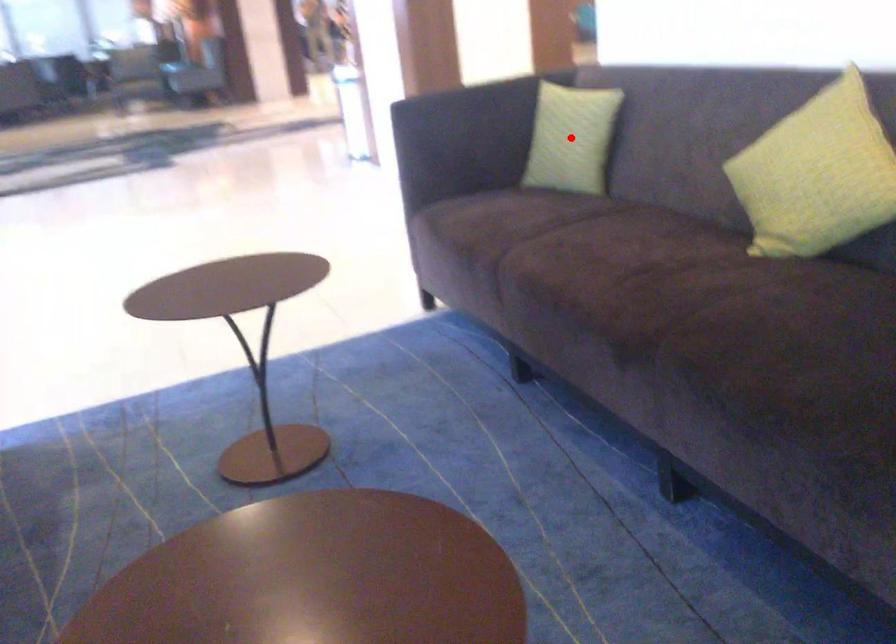
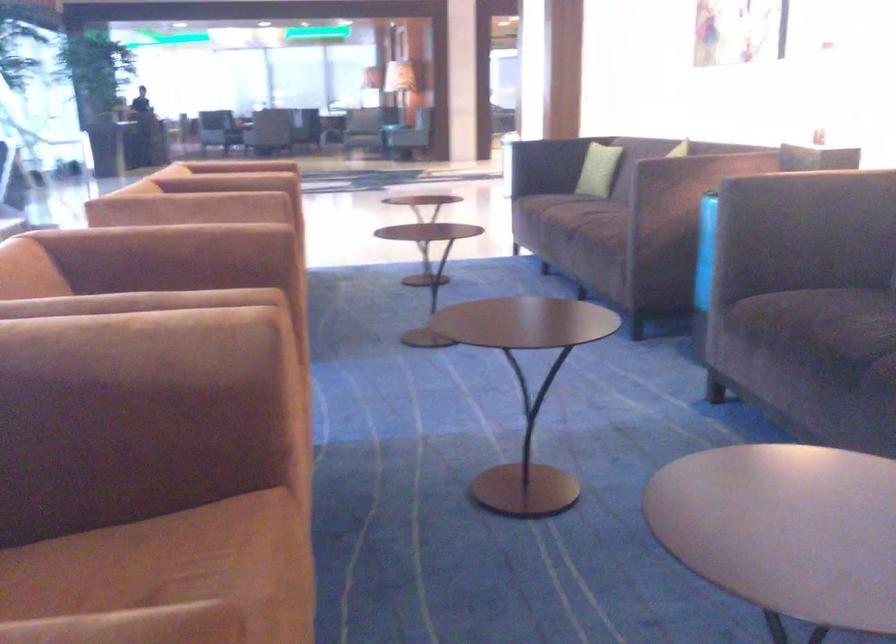
Question: I am providing you with two images of the same scene from different viewpoints. A red point is marked on the first image. Can you still see the location of the red point in image 2?

Choices:
 (A) Yes
 (B) No

Answer: (B)